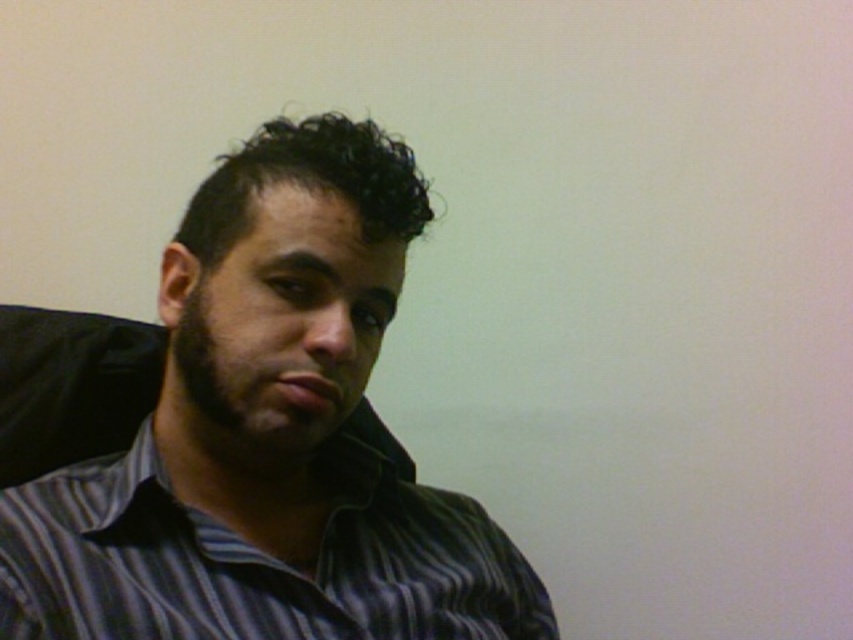
You are a tailor measuring a person for a custom shirt. You notice the striped shirt at center and the striped cotton shirt at center on the subject. Since you need to ensure proper fit, can you determine if there is enough space between the two shirts to comfortably insert a measuring tape?

The striped shirt at center and striped cotton shirt at center are 1.83 inches apart from each other. Since a standard measuring tape is about 1 inch wide, there is sufficient space to insert it between the two shirts comfortably.

You are an interior designer analyzing the placement of clothing items in the image. The striped shirt at center and the striped cotton shirt at center are both visible. Which one appears closer to you?

The striped shirt at center appears closer to you because it is positioned further to the viewer than the striped cotton shirt at center.

You are an interior designer analyzing the placement of furniture in a room. You notice a point at coordinates (268, 436) in the image. According to the scene description, what object is located at that point?

The point at coordinates (268, 436) corresponds to the striped shirt at center.